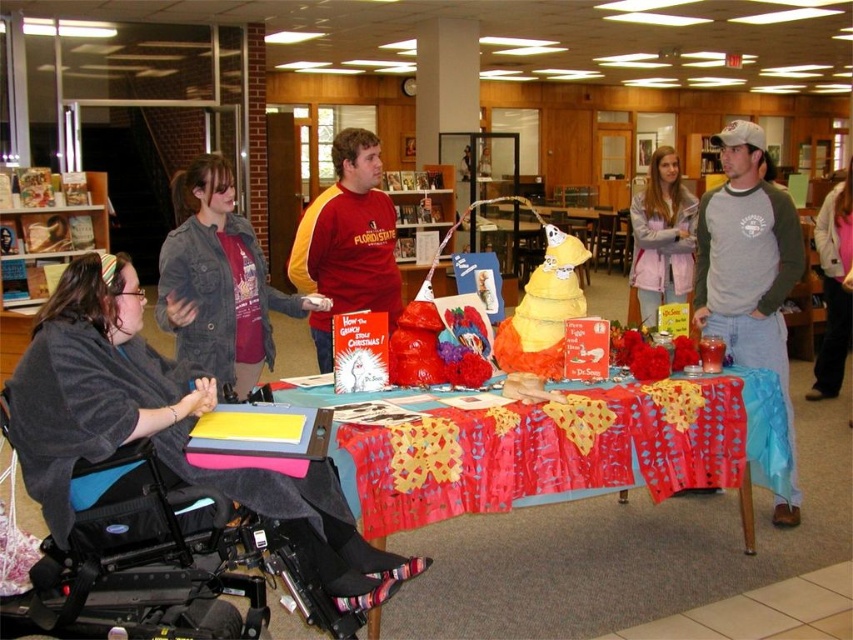
Can you confirm if red matte shirt at center is smaller than pastel pink hoodie at upper right?

Actually, red matte shirt at center might be larger than pastel pink hoodie at upper right.

Does point (305, 220) come closer to viewer compared to point (645, 317)?

Yes.

Is point (316, 353) positioned behind point (657, 291)?

No.

Identify the location of red matte shirt at center. The height and width of the screenshot is (640, 853). (347, 241).

Who is more distant from viewer, (364, 506) or (392, 310)?

→ Point (392, 310)

This screenshot has height=640, width=853. Find the location of `red fabric tablecloth at center`. red fabric tablecloth at center is located at coordinates (566, 449).

Can you confirm if black fabric wheelchair at lower left is taller than gray fleece jacket at upper center?

No.

Does black fabric wheelchair at lower left appear over gray fleece jacket at upper center?

No, black fabric wheelchair at lower left is not above gray fleece jacket at upper center.

Identify the location of black fabric wheelchair at lower left. (169, 563).

Locate an element on the screen. This screenshot has width=853, height=640. black fabric wheelchair at lower left is located at coordinates (169, 563).